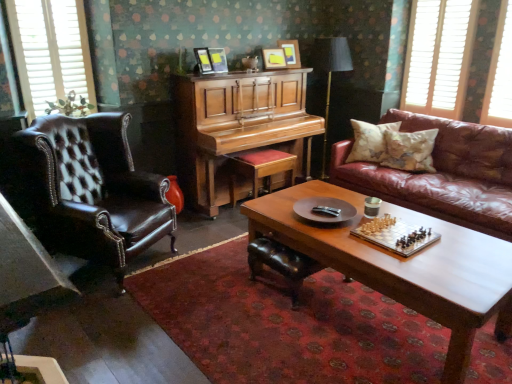
What are the coordinates of `free area below wooden polished coffee table at center (from a real-world perspective)` in the screenshot? It's located at (386, 323).